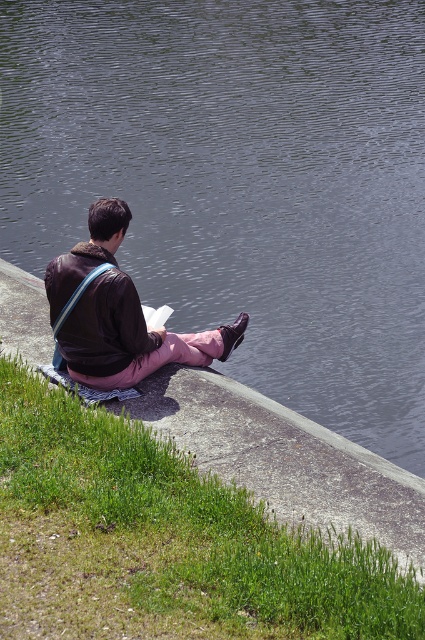
Question: Is green grass at lower left bigger than matte brown jacket at center?

Choices:
 (A) no
 (B) yes

Answer: (B)

Question: Which object appears farthest from the camera in this image?

Choices:
 (A) matte brown jacket at center
 (B) green grass at lower left

Answer: (A)

Question: Which point is farther to the camera?

Choices:
 (A) green grass at lower left
 (B) matte brown jacket at center

Answer: (B)

Question: Does green grass at lower left have a larger size compared to matte brown jacket at center?

Choices:
 (A) yes
 (B) no

Answer: (A)

Question: In this image, where is green grass at lower left located relative to matte brown jacket at center?

Choices:
 (A) above
 (B) below

Answer: (B)